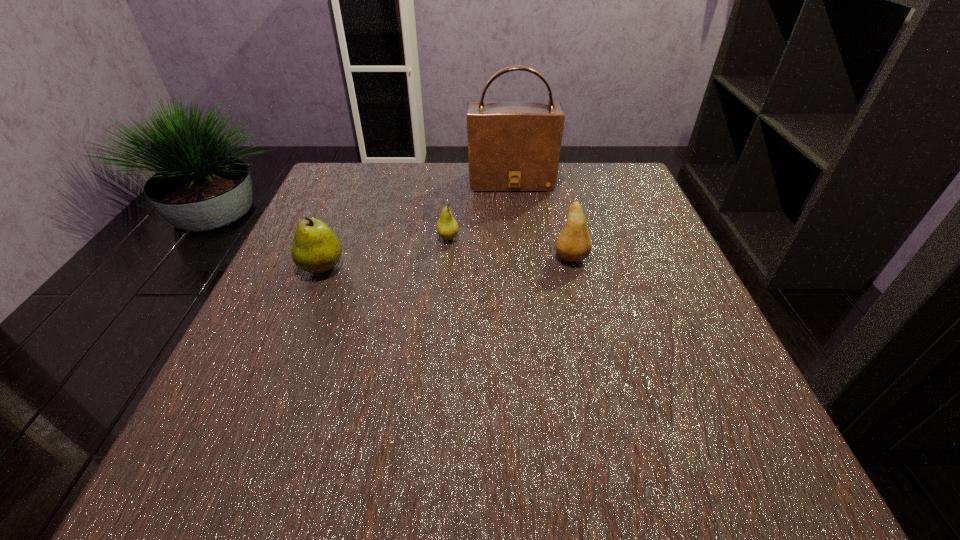
I want to click on object that is at the far edge, so click(x=512, y=146).

This screenshot has width=960, height=540. Identify the location of object present at the left edge. (316, 249).

This screenshot has width=960, height=540. I want to click on vacant space at the far edge, so (390, 179).

In the image, there is a desktop. What are the coordinates of `vacant space at the near edge` in the screenshot? It's located at (534, 451).

I want to click on vacant space at the left edge of the desktop, so click(320, 389).

You are a GUI agent. You are given a task and a screenshot of the screen. Output one action in this format:
    pyautogui.click(x=<x>, y=<y>)
    Task: Click on the free space at the right edge
    
    Given the screenshot: What is the action you would take?
    pyautogui.click(x=660, y=390)

Identify the location of vacant space at the far left corner of the desktop. (331, 181).

At what (x,y) coordinates should I click in order to perform the action: click on free space at the near left corner. Please return your answer as a coordinate pair (x, y). The width and height of the screenshot is (960, 540). Looking at the image, I should click on (251, 429).

Identify the location of vacant space at the far right corner. (630, 164).

This screenshot has width=960, height=540. I want to click on empty location between the rightmost pear and the shortest pear, so click(510, 248).